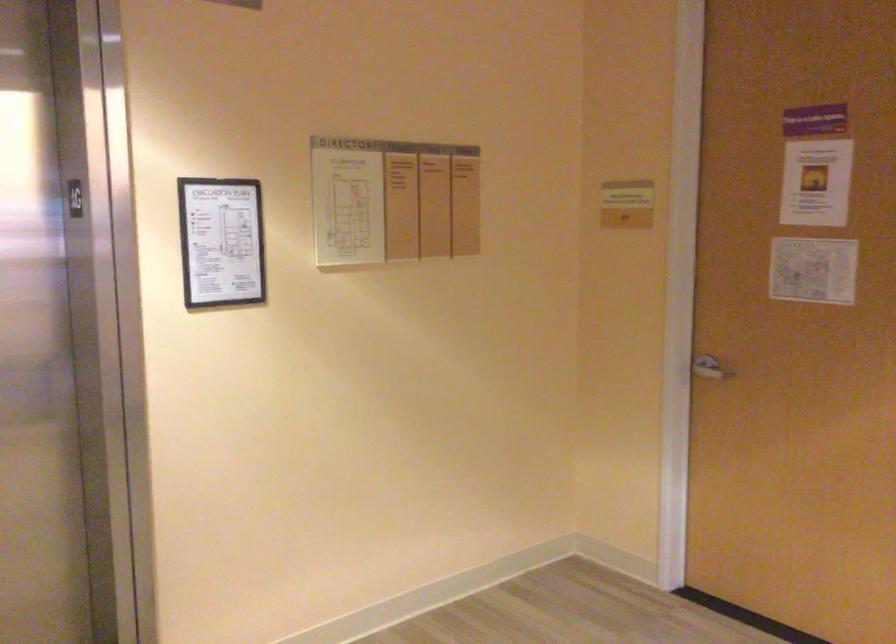
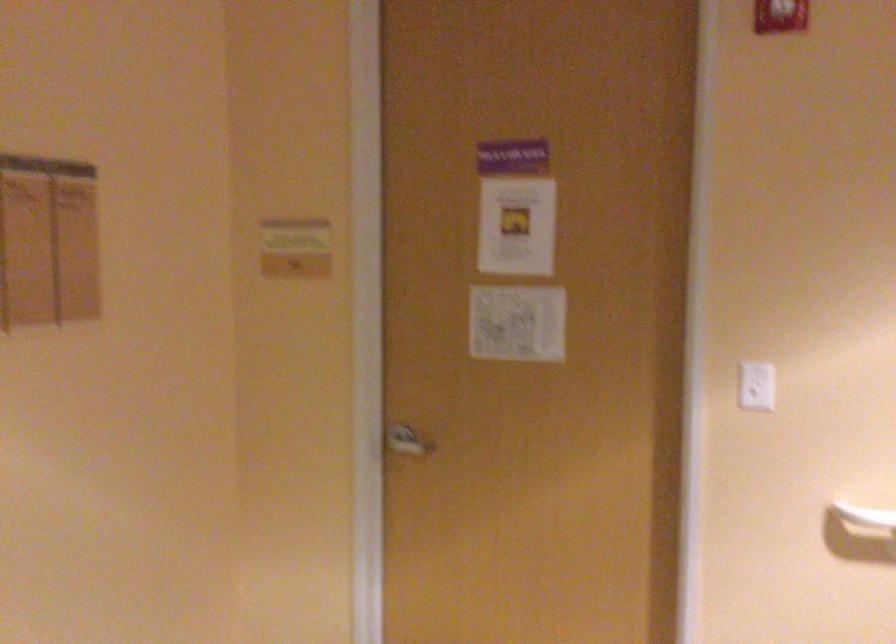
Find the pixel in the second image that matches point (711, 368) in the first image.

(407, 442)